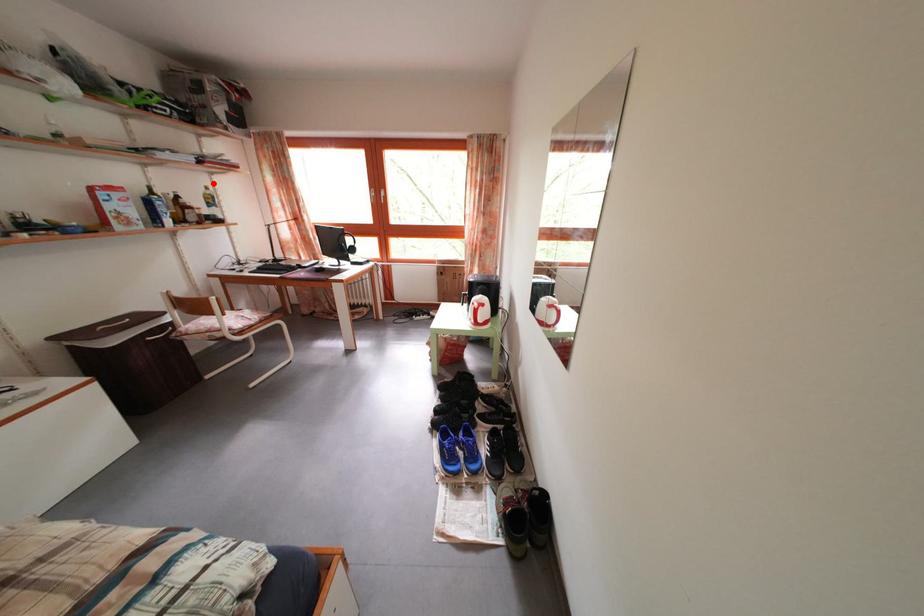
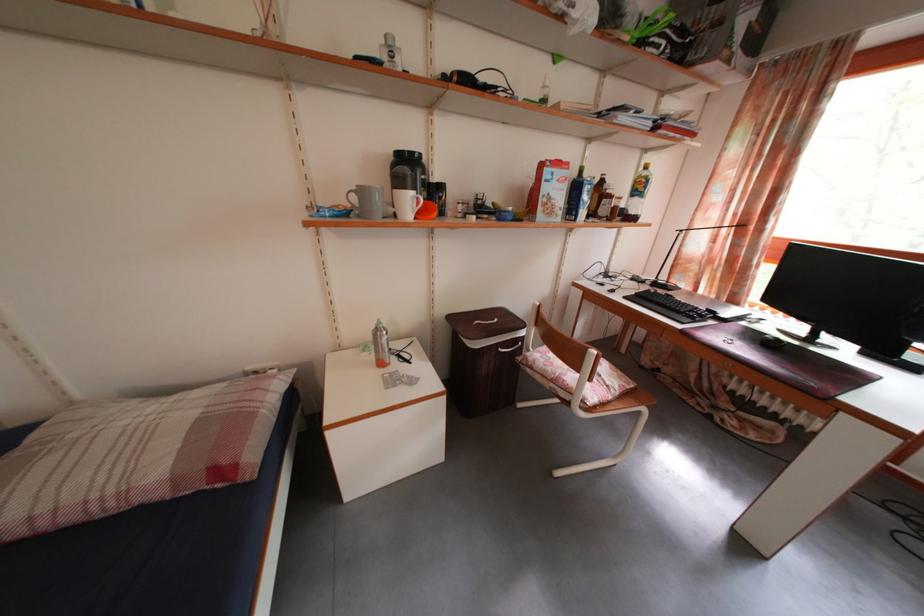
Question: I am providing you with two images of the same scene from different viewpoints. Image1 has a red point marked. In image2, the corresponding 3D location appears at what relative position? Reply with the corresponding letter.

Choices:
 (A) Closer
 (B) Farther

Answer: (A)